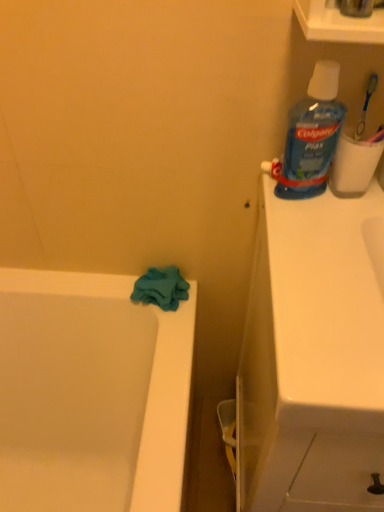
Question: In the image, is blue plastic toothbrush at upper right positioned in front of or behind teal soft cloth at lower left?

Choices:
 (A) behind
 (B) front

Answer: (B)

Question: Is blue plastic toothbrush at upper right spatially inside teal soft cloth at lower left, or outside of it?

Choices:
 (A) inside
 (B) outside

Answer: (B)

Question: Considering the real-world distances, which object is closest to the blue translucent plastic mouthwash at upper right?

Choices:
 (A) white matte toilet paper at upper right
 (B) blue plastic toothbrush at upper right
 (C) white glossy sink at upper right
 (D) teal soft cloth at lower left

Answer: (A)

Question: Estimate the real-world distances between objects in this image. Which object is farther from the blue translucent plastic mouthwash at upper right?

Choices:
 (A) teal soft cloth at lower left
 (B) white matte toilet paper at upper right
 (C) blue plastic toothbrush at upper right
 (D) white glossy sink at upper right

Answer: (A)